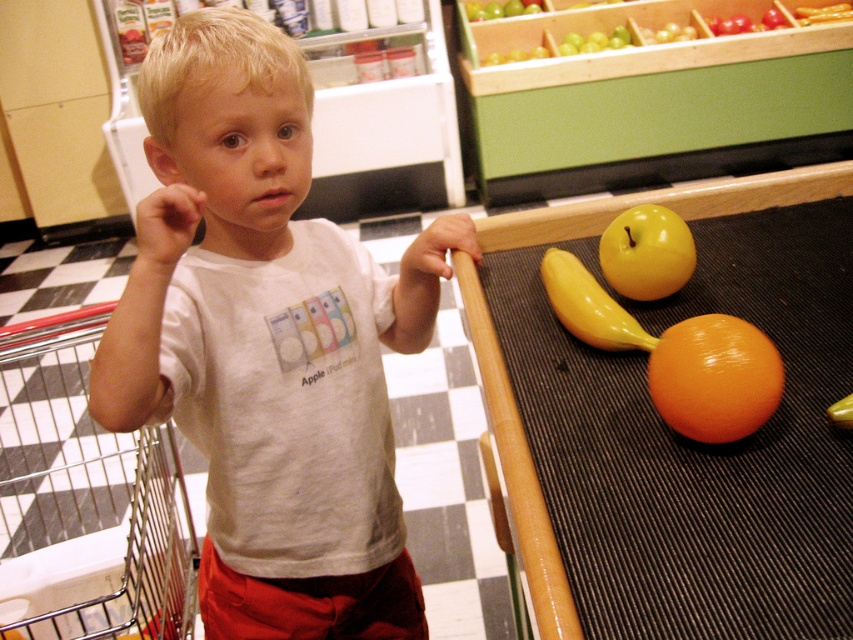
From the picture: Can you confirm if metallic silver shopping cart at left is positioned below yellow rubber banana at center?

Correct, metallic silver shopping cart at left is located below yellow rubber banana at center.

How much distance is there between metallic silver shopping cart at left and yellow rubber banana at center?

metallic silver shopping cart at left is 1.26 meters away from yellow rubber banana at center.

Where is `metallic silver shopping cart at left`? metallic silver shopping cart at left is located at coordinates (84, 500).

Find the location of a particular element. The height and width of the screenshot is (640, 853). metallic silver shopping cart at left is located at coordinates (84, 500).

Who is shorter, metallic silver shopping cart at left or glossy orange at lower right?

glossy orange at lower right is shorter.

Is metallic silver shopping cart at left positioned at the back of glossy orange at lower right?

That is True.

Is point (113, 566) farther from viewer compared to point (671, 368)?

Yes, point (113, 566) is farther from viewer.

Where is `metallic silver shopping cart at left`? The width and height of the screenshot is (853, 640). metallic silver shopping cart at left is located at coordinates (84, 500).

Which is above, white cotton shirt at center or yellow shiny apple at upper right?

yellow shiny apple at upper right is above.

How distant is white cotton shirt at center from yellow shiny apple at upper right?

The distance of white cotton shirt at center from yellow shiny apple at upper right is 18.46 inches.

Measure the distance between point [335,300] and camera.

A distance of 39.08 inches exists between point [335,300] and camera.

You are a GUI agent. You are given a task and a screenshot of the screen. Output one action in this format:
    pyautogui.click(x=<x>, y=<y>)
    Task: Click on the white cotton shirt at center
    Image resolution: width=853 pixels, height=640 pixels.
    Given the screenshot: What is the action you would take?
    pyautogui.click(x=268, y=342)